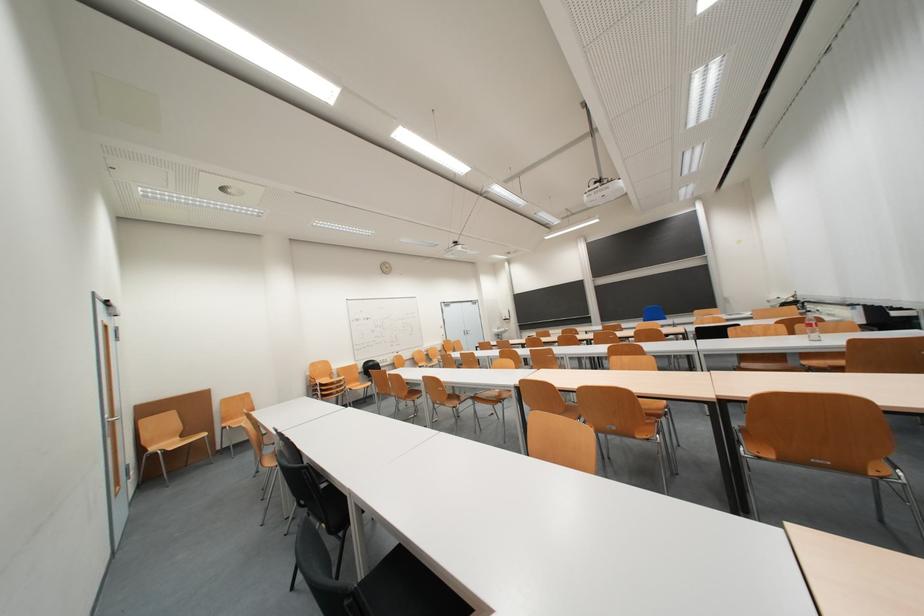
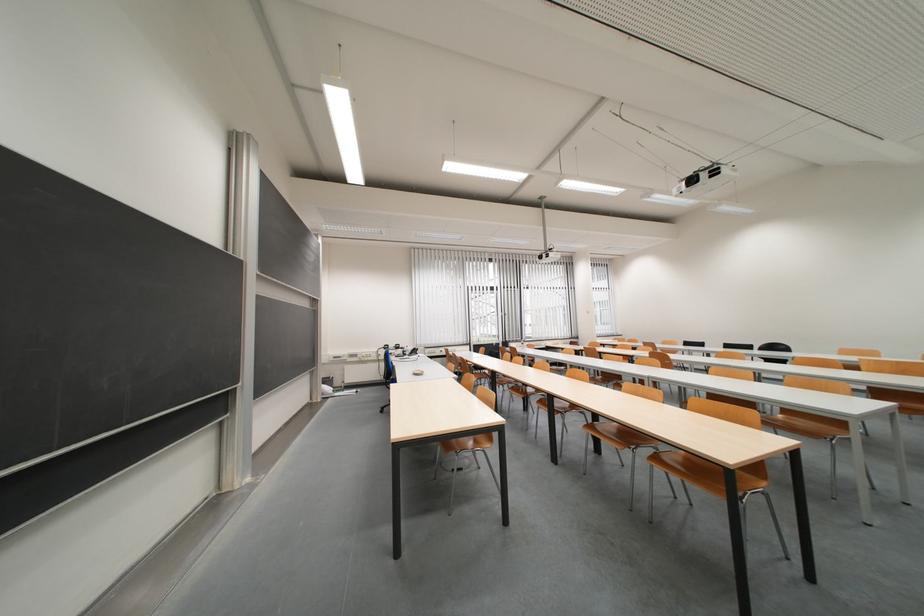
Question: I am providing you with two images of the same scene from different viewpoints. Which of the following objects are not visible in image2?

Choices:
 (A) orange toy carrot
 (B) wooden chair sitting surface
 (C) chalkboard bottom rail
 (D) small white bowl

Answer: (B)